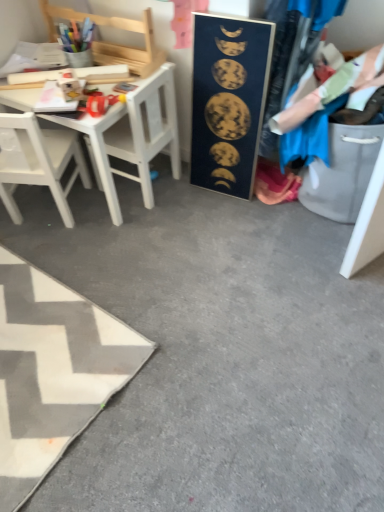
Find the location of a particular element. The width and height of the screenshot is (384, 512). white fabric rug at lower left is located at coordinates (53, 372).

What are the coordinates of `white matte chair at left` in the screenshot? It's located at (147, 129).

At what (x,y) coordinates should I click in order to perform the action: click on white fabric rug at lower left. Please return your answer as a coordinate pair (x, y). The image size is (384, 512). Looking at the image, I should click on (53, 372).

From the image's perspective, is dark blue matte poster at center positioned above or below white matte chair at left, the 1th chair positioned from the bottom?

Based on their image positions, dark blue matte poster at center is located above white matte chair at left, the 1th chair positioned from the bottom.

Does dark blue matte poster at center contain white matte chair at left, which is counted as the second chair, starting from the top?

Actually, white matte chair at left, which is counted as the second chair, starting from the top, is outside dark blue matte poster at center.

In terms of width, does dark blue matte poster at center look wider or thinner when compared to white matte chair at left, which is counted as the second chair, starting from the top?

Clearly, dark blue matte poster at center has less width compared to white matte chair at left, which is counted as the second chair, starting from the top.

In the scene shown: Between dark blue matte poster at center and white matte chair at left, which is counted as the second chair, starting from the top, which one has less height?

white matte chair at left, which is counted as the second chair, starting from the top, is shorter.

From a real-world perspective, is white matte chair at left, which is counted as the second chair, starting from the top, under white fabric rug at lower left?

Incorrect, from a real-world perspective, white matte chair at left, which is counted as the second chair, starting from the top, is higher than white fabric rug at lower left.

Is point (65, 205) farther from viewer compared to point (115, 392)?

Yes, point (65, 205) is farther from viewer.

The image size is (384, 512). Identify the location of chair that is the 1st object located above the white fabric rug at lower left (from the image's perspective). (38, 161).

Is white matte chair at left, the 1th chair positioned from the bottom, turned away from white fabric rug at lower left?

Absolutely, white matte chair at left, the 1th chair positioned from the bottom, is directed away from white fabric rug at lower left.

Considering the sizes of objects white wooden desk at upper left and blue fabric at right in the image provided, who is shorter, white wooden desk at upper left or blue fabric at right?

With less height is blue fabric at right.

From the image's perspective, does white wooden desk at upper left appear lower than blue fabric at right?

Correct, white wooden desk at upper left appears lower than blue fabric at right in the image.

At what (x,y) coordinates should I click in order to perform the action: click on desk behind the blue fabric at right. Please return your answer as a coordinate pair (x, y). This screenshot has width=384, height=512. Looking at the image, I should click on (131, 135).

Considering the relative sizes of white wooden desk at upper left and blue fabric at right in the image provided, is white wooden desk at upper left thinner than blue fabric at right?

Yes.

From the image's perspective, is white matte chair at left on dark blue matte poster at center?

No, from the image's perspective, white matte chair at left is not above dark blue matte poster at center.

Considering the relative sizes of white matte chair at left and dark blue matte poster at center in the image provided, is white matte chair at left smaller than dark blue matte poster at center?

Incorrect, white matte chair at left is not smaller in size than dark blue matte poster at center.

Is white matte chair at left facing towards dark blue matte poster at center?

No, white matte chair at left is not facing towards dark blue matte poster at center.

Is white matte chair at left shorter than dark blue matte poster at center?

Yes, white matte chair at left is shorter than dark blue matte poster at center.

Which is behind, white fabric rug at lower left or white matte chair at left, which is counted as the second chair, starting from the top?

white matte chair at left, which is counted as the second chair, starting from the top, is further from the camera.

From the image's perspective, between white fabric rug at lower left and white matte chair at left, the 1th chair positioned from the bottom, which one is located above?

white matte chair at left, the 1th chair positioned from the bottom.

Could you measure the distance between white fabric rug at lower left and white matte chair at left, which is counted as the second chair, starting from the top?

white fabric rug at lower left is 22.66 inches from white matte chair at left, which is counted as the second chair, starting from the top.

Based on their sizes in the image, would you say white fabric rug at lower left is bigger or smaller than white matte chair at left, the 1th chair positioned from the bottom?

Considering their sizes, white fabric rug at lower left takes up more space than white matte chair at left, the 1th chair positioned from the bottom.

Between white matte chair at left and white fabric rug at lower left, which one has smaller width?

With smaller width is white matte chair at left.

How many degrees apart are the facing directions of white matte chair at left and white fabric rug at lower left?

There is a 6.71-degree angle between the facing directions of white matte chair at left and white fabric rug at lower left.

From the picture: Does white matte chair at left appear on the right side of white fabric rug at lower left?

Yes, white matte chair at left is to the right of white fabric rug at lower left.

Can you confirm if blue fabric at right is thinner than dark blue matte poster at center?

In fact, blue fabric at right might be wider than dark blue matte poster at center.

In terms of height, does blue fabric at right look taller or shorter compared to dark blue matte poster at center?

Considering their sizes, blue fabric at right has less height than dark blue matte poster at center.

Is point (338, 97) less distant than point (242, 184)?

That is True.

Looking at this image, how different are the orientations of blue fabric at right and dark blue matte poster at center in degrees?

3.47 degrees.

The height and width of the screenshot is (512, 384). I want to click on the 1st chair behind the dark blue matte poster at center, so (38, 161).

This screenshot has width=384, height=512. I want to click on the 1st chair above the white fabric rug at lower left (from the image's perspective), so click(38, 161).

Looking at this image, looking at the image, which one is located closer to white matte chair at left, dark blue matte poster at center or white fabric rug at lower left?

Based on the image, dark blue matte poster at center appears to be nearer to white matte chair at left.

Considering their positions, is white matte chair at left positioned closer to blue fabric at right than wooden chair at upper left, the 1th chair in the top-to-bottom sequence?

The object closer to blue fabric at right is white matte chair at left.

Which object lies further to the anchor point white wooden desk at upper left, wooden chair at upper left, the 2th chair when ordered from bottom to top, or dark blue matte poster at center?

dark blue matte poster at center.

When comparing their distances from white fabric rug at lower left, does white matte chair at left or dark blue matte poster at center seem closer?

white matte chair at left is closer to white fabric rug at lower left.

Based on their spatial positions, is white fabric rug at lower left or white matte chair at left closer to wooden chair at upper left, the 1th chair in the top-to-bottom sequence?

white matte chair at left.

From the image, which object appears to be nearer to white fabric rug at lower left, white matte chair at left, the 1th chair positioned from the bottom, or white matte chair at left?

Based on the image, white matte chair at left, the 1th chair positioned from the bottom, appears to be nearer to white fabric rug at lower left.

Based on their spatial positions, is white matte chair at left or white wooden desk at upper left closer to dark blue matte poster at center?

The object closer to dark blue matte poster at center is white matte chair at left.

Which object lies nearer to the anchor point wooden chair at upper left, the 2th chair when ordered from bottom to top, white matte chair at left or white fabric rug at lower left?

The object closer to wooden chair at upper left, the 2th chair when ordered from bottom to top, is white matte chair at left.

Find the location of a particular element. The height and width of the screenshot is (512, 384). armchair between wooden chair at upper left, the 2th chair when ordered from bottom to top, and white matte chair at left, which is counted as the second chair, starting from the top, vertically is located at coordinates (147, 129).

Where is `desk between white fabric rug at lower left and blue fabric at right`? This screenshot has height=512, width=384. desk between white fabric rug at lower left and blue fabric at right is located at coordinates click(131, 135).

Image resolution: width=384 pixels, height=512 pixels. What are the coordinates of `armchair located between wooden chair at upper left, the 2th chair when ordered from bottom to top, and blue fabric at right in the left-right direction` in the screenshot? It's located at (147, 129).

I want to click on armchair between dark blue matte poster at center and white fabric rug at lower left in the vertical direction, so click(147, 129).